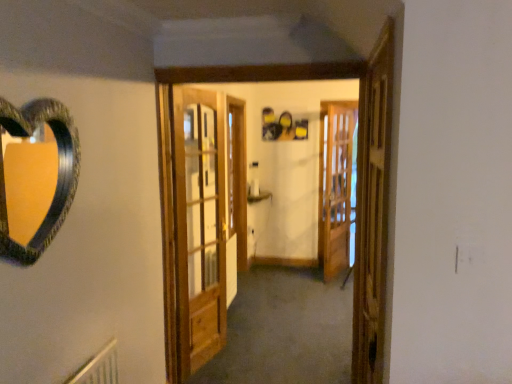
At what (x,y) coordinates should I click in order to perform the action: click on vacant space situated on the left part of wooden screen door at center, which is the 1th screen door in right-to-left order. Please return your answer as a coordinate pair (x, y). The height and width of the screenshot is (384, 512). Looking at the image, I should click on (295, 276).